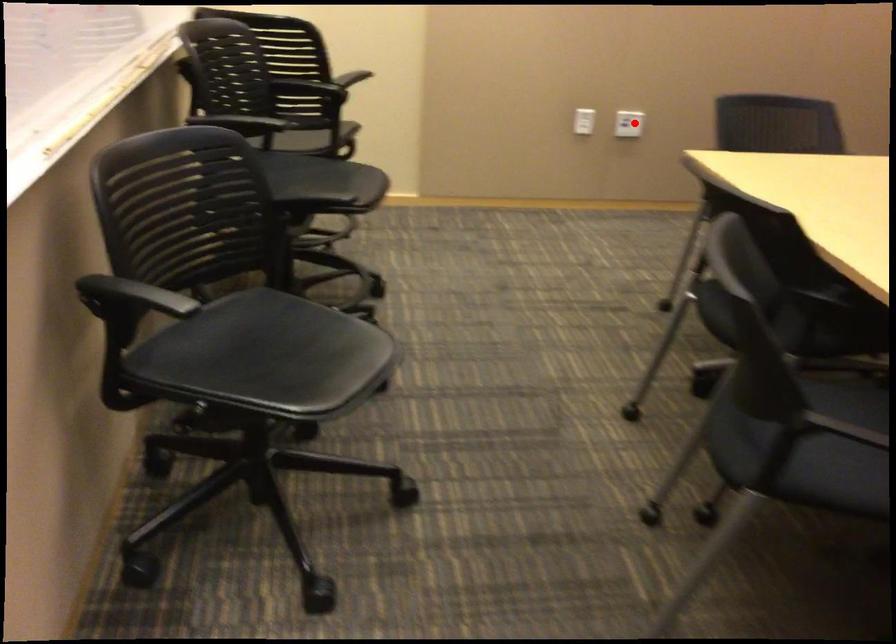
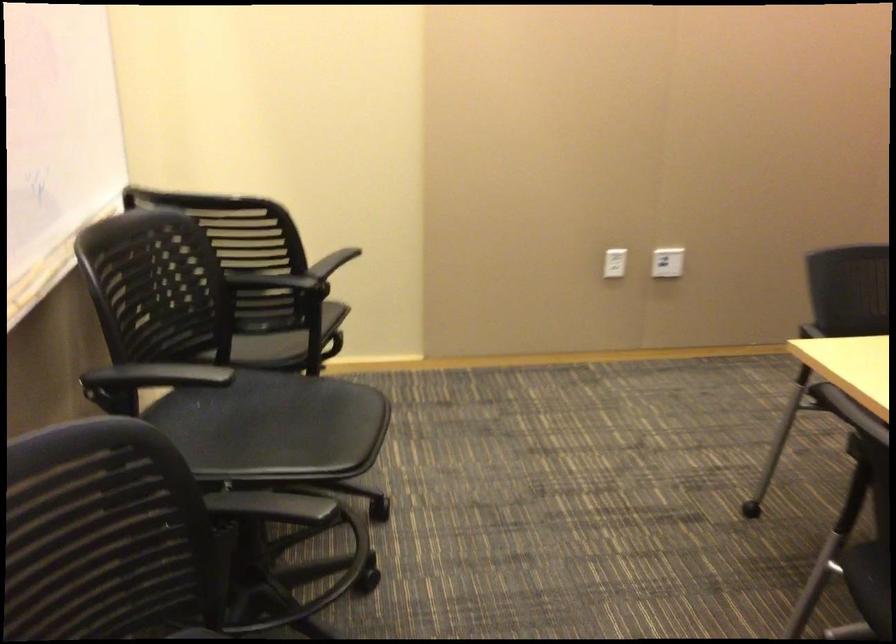
Locate, in the second image, the point that corresponds to the highlighted location in the first image.

(667, 261)